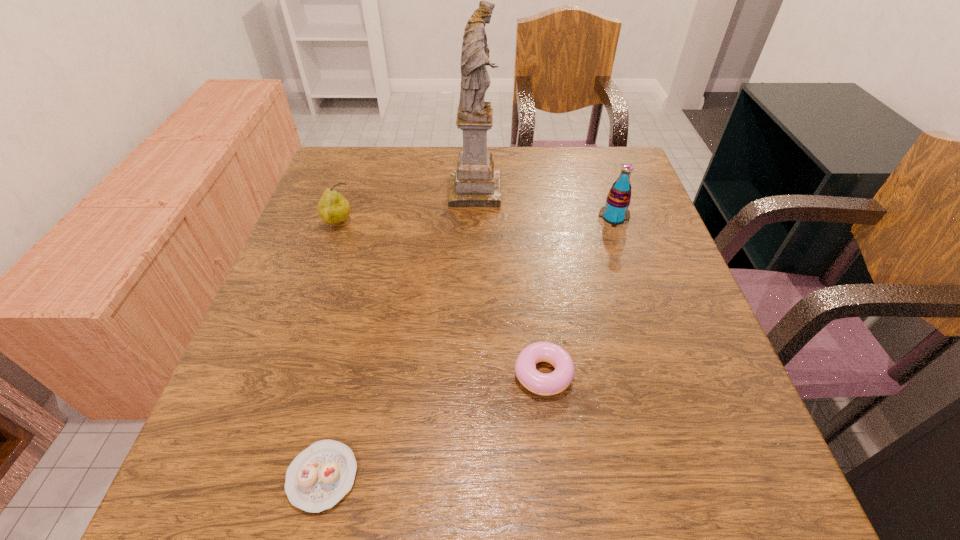
Find the location of a particular element. This screenshot has width=960, height=540. vacant region that satisfies the following two spatial constraints: 1. on the front side of the pear; 2. on the left side of the cupcake is located at coordinates (251, 476).

This screenshot has width=960, height=540. I want to click on vacant space that satisfies the following two spatial constraints: 1. on the front-facing side of the fourth object from left to right; 2. on the left side of the tallest object, so click(x=472, y=373).

You are a GUI agent. You are given a task and a screenshot of the screen. Output one action in this format:
    pyautogui.click(x=<x>, y=<y>)
    Task: Click on the vacant region that satisfies the following two spatial constraints: 1. on the front-facing side of the soda; 2. on the right side of the farthest object
    
    Given the screenshot: What is the action you would take?
    pyautogui.click(x=474, y=218)

You are a GUI agent. You are given a task and a screenshot of the screen. Output one action in this format:
    pyautogui.click(x=<x>, y=<y>)
    Task: Click on the free spot that satisfies the following two spatial constraints: 1. on the front-facing side of the farthest object; 2. on the front side of the leftmost object
    Image resolution: width=960 pixels, height=540 pixels.
    Given the screenshot: What is the action you would take?
    pyautogui.click(x=474, y=223)